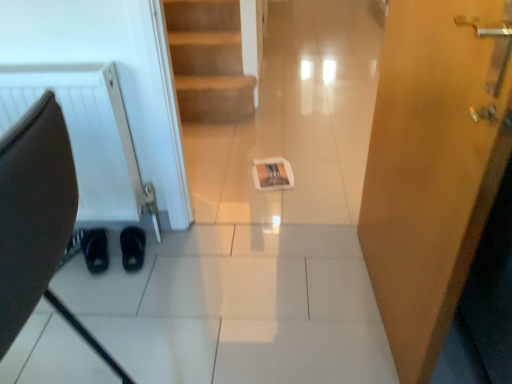
You are a GUI agent. You are given a task and a screenshot of the screen. Output one action in this format:
    pyautogui.click(x=<x>, y=<y>)
    Task: Click on the vacant area that lies between matte paper magazine at center and black suede shoes at lower left, the first footwear positioned from the right
    The image size is (512, 384).
    Given the screenshot: What is the action you would take?
    pyautogui.click(x=218, y=206)